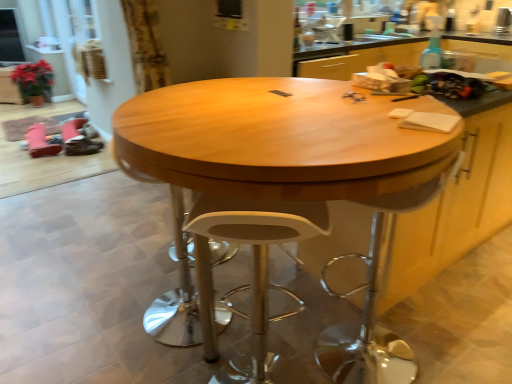
Question: Considering the relative positions of wooden cabinet at center, marked as the first cabinetry in a right-to-left arrangement, and white plastic swivel chair at center in the image provided, is wooden cabinet at center, marked as the first cabinetry in a right-to-left arrangement, in front of white plastic swivel chair at center?

Choices:
 (A) no
 (B) yes

Answer: (A)

Question: From the image's perspective, is wooden cabinet at center, which appears as the first cabinetry when viewed from the front, beneath white plastic swivel chair at center?

Choices:
 (A) yes
 (B) no

Answer: (B)

Question: Is wooden cabinet at center, marked as the second cabinetry in a top-to-bottom arrangement, far from white plastic swivel chair at center?

Choices:
 (A) no
 (B) yes

Answer: (A)

Question: From a real-world perspective, does wooden cabinet at center, which appears as the first cabinetry when viewed from the front, stand above white plastic swivel chair at center?

Choices:
 (A) no
 (B) yes

Answer: (B)

Question: Considering the relative positions of wooden cabinet at center, positioned as the second cabinetry in left-to-right order, and white plastic swivel chair at center in the image provided, is wooden cabinet at center, positioned as the second cabinetry in left-to-right order, to the left of white plastic swivel chair at center from the viewer's perspective?

Choices:
 (A) no
 (B) yes

Answer: (A)

Question: Based on their sizes in the image, would you say wooden table at center is bigger or smaller than white plastic swivel chair at center?

Choices:
 (A) small
 (B) big

Answer: (B)

Question: From the image's perspective, is wooden table at center positioned above or below white plastic swivel chair at center?

Choices:
 (A) below
 (B) above

Answer: (B)

Question: Relative to white plastic swivel chair at center, is wooden table at center in front or behind?

Choices:
 (A) behind
 (B) front

Answer: (B)

Question: From a real-world perspective, is wooden table at center above or below white plastic swivel chair at center?

Choices:
 (A) below
 (B) above

Answer: (B)

Question: From the image's perspective, is white plastic stool at center positioned above or below wooden cabinet at center, which appears as the first cabinetry when viewed from the front?

Choices:
 (A) below
 (B) above

Answer: (A)

Question: From a real-world perspective, is white plastic stool at center above or below wooden cabinet at center, marked as the first cabinetry in a right-to-left arrangement?

Choices:
 (A) above
 (B) below

Answer: (B)

Question: Considering the positions of white plastic stool at center and wooden cabinet at center, marked as the second cabinetry in a top-to-bottom arrangement, in the image, is white plastic stool at center taller or shorter than wooden cabinet at center, marked as the second cabinetry in a top-to-bottom arrangement,?

Choices:
 (A) tall
 (B) short

Answer: (B)

Question: Based on their positions, is white plastic stool at center located to the left or right of wooden cabinet at center, the first cabinetry in the bottom-to-top sequence?

Choices:
 (A) left
 (B) right

Answer: (A)

Question: Considering the positions of green matte plant at left, which ranks as the 1th cabinetry in back-to-front order, and white plastic swivel chair at center in the image, is green matte plant at left, which ranks as the 1th cabinetry in back-to-front order, bigger or smaller than white plastic swivel chair at center?

Choices:
 (A) small
 (B) big

Answer: (B)

Question: Considering the positions of point (5, 87) and point (352, 344), is point (5, 87) closer or farther from the camera than point (352, 344)?

Choices:
 (A) closer
 (B) farther

Answer: (B)